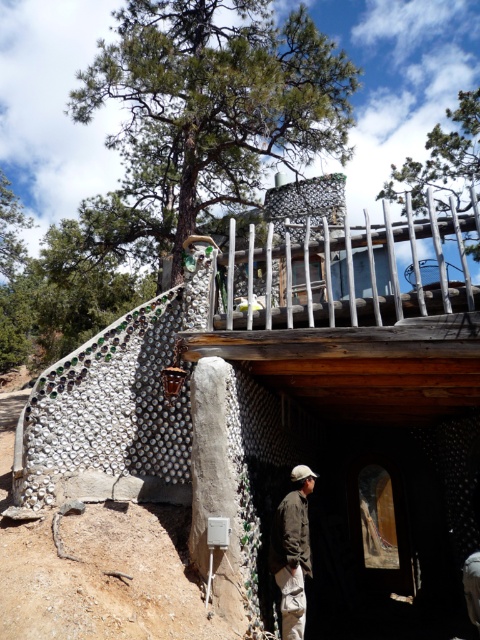
Question: Can you confirm if bottle mosaic hut at upper center is positioned to the right of brown fabric jacket at lower center?

Choices:
 (A) yes
 (B) no

Answer: (A)

Question: Considering the relative positions of bottle mosaic hut at upper center and brown fabric jacket at lower center in the image provided, where is bottle mosaic hut at upper center located with respect to brown fabric jacket at lower center?

Choices:
 (A) below
 (B) above

Answer: (B)

Question: Is bottle mosaic hut at upper center closer to the viewer compared to brown fabric jacket at lower center?

Choices:
 (A) yes
 (B) no

Answer: (B)

Question: Which of the following is the farthest from the observer?

Choices:
 (A) (300, 612)
 (B) (322, 250)

Answer: (B)

Question: Which point is farther to the camera?

Choices:
 (A) (387, 564)
 (B) (278, 522)

Answer: (A)

Question: Which point appears closest to the camera in this image?

Choices:
 (A) (285, 516)
 (B) (369, 305)

Answer: (A)